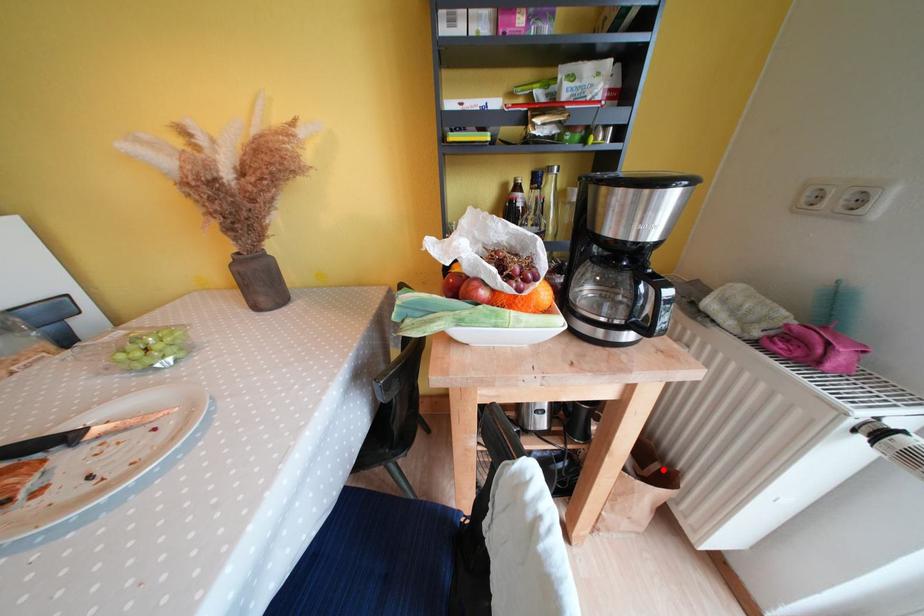
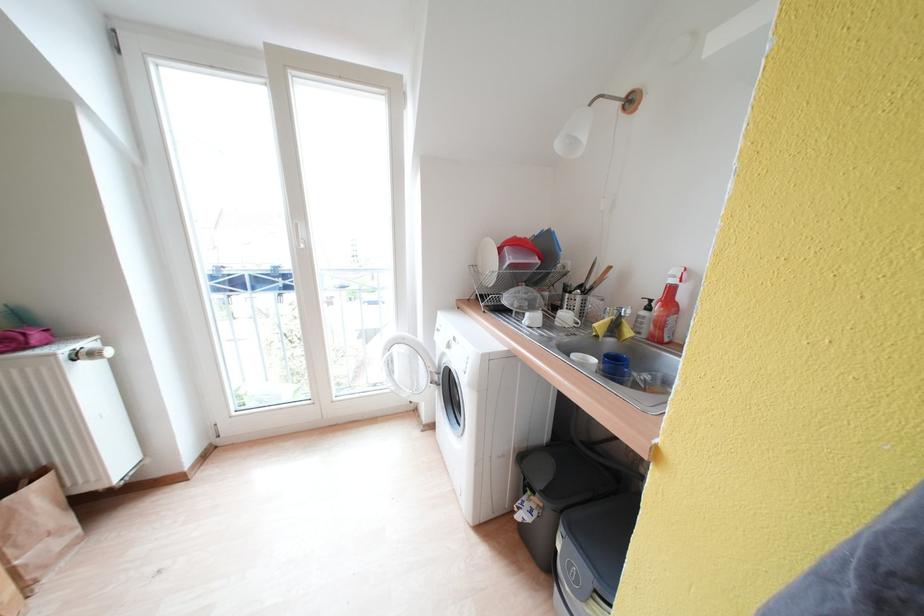
Locate, in the second image, the point that corresponds to the highlighted location in the first image.

(30, 485)